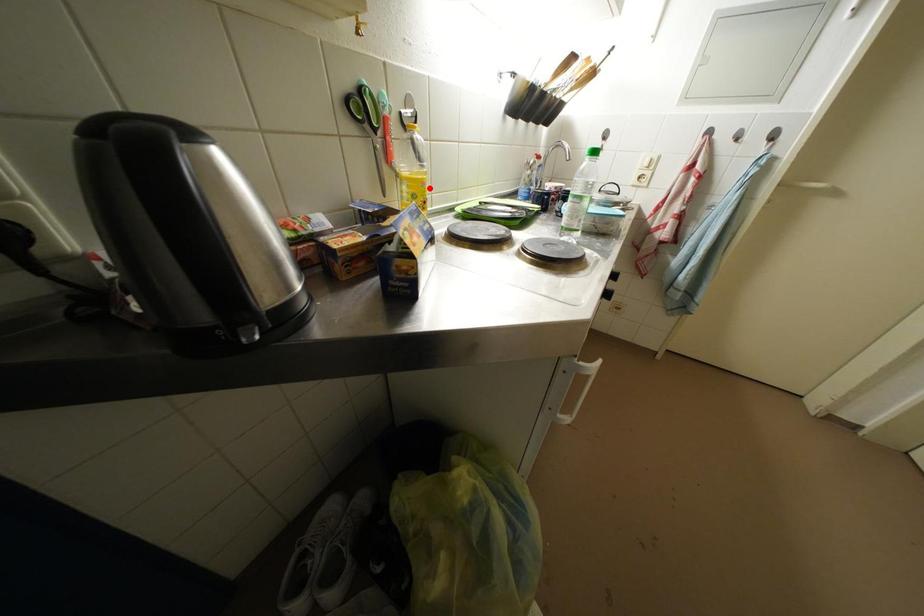
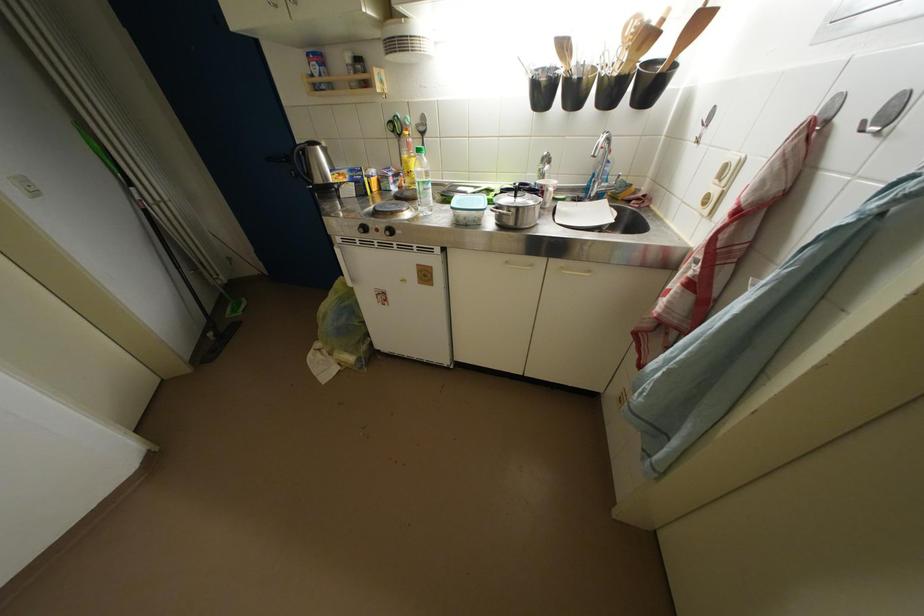
In the second image, find the point that corresponds to the highlighted location in the first image.

(412, 167)